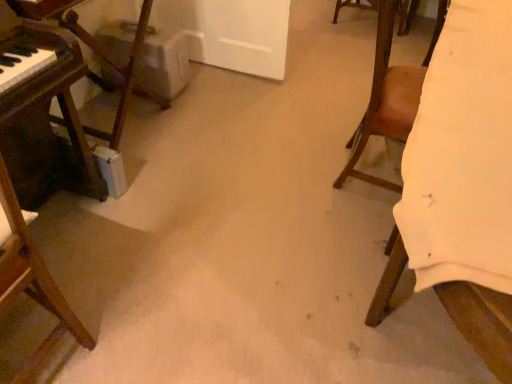
What are the coordinates of `brown wooden chair at left, which is the 1th chair in left-to-right order` in the screenshot? It's located at (31, 279).

What is the approximate width of brown leather chair at right, the 1th chair from the right?

brown leather chair at right, the 1th chair from the right, is 17.85 inches wide.

I want to click on wooden piano at left, marked as the 1th furniture in a left-to-right arrangement, so click(x=57, y=98).

Which of these two, brown wooden chair at left, which is the 1th chair in left-to-right order, or brown leather chair at right, which is the second chair in left-to-right order, is wider?

brown wooden chair at left, which is the 1th chair in left-to-right order, is wider.

Is brown wooden chair at left, the 2th chair from the right, looking in the opposite direction of brown leather chair at right, the 1th chair from the right?

No, brown wooden chair at left, the 2th chair from the right,'s orientation is not away from brown leather chair at right, the 1th chair from the right.

From the image's perspective, is brown wooden chair at left, the 2th chair from the right, beneath brown leather chair at right, which is the second chair in left-to-right order?

Yes.

Is brown wooden chair at left, the 2th chair from the right, in front of white fabric at right, the first furniture viewed from the right?

That is False.

From the image's perspective, between brown wooden chair at left, the 2th chair from the right, and white fabric at right, the first furniture viewed from the right, who is located below?

brown wooden chair at left, the 2th chair from the right, is shown below in the image.

Is point (33, 255) more distant than point (490, 325)?

Yes.

How far apart are brown wooden chair at left, the 2th chair from the right, and white fabric at right, the first furniture viewed from the right?

brown wooden chair at left, the 2th chair from the right, is 3.31 feet away from white fabric at right, the first furniture viewed from the right.

Between brown wooden chair at left, which is the 1th chair in left-to-right order, and wooden piano at left, acting as the 2th furniture starting from the right, which one has smaller size?

brown wooden chair at left, which is the 1th chair in left-to-right order.

Which of these two, brown wooden chair at left, which is the 1th chair in left-to-right order, or wooden piano at left, marked as the 1th furniture in a left-to-right arrangement, stands taller?

brown wooden chair at left, which is the 1th chair in left-to-right order.

From the image's perspective, between brown wooden chair at left, which is the 1th chair in left-to-right order, and wooden piano at left, acting as the 2th furniture starting from the right, who is located below?

From the image's view, brown wooden chair at left, which is the 1th chair in left-to-right order, is below.

Consider the image. Is brown leather chair at right, which is the second chair in left-to-right order, not inside brown wooden chair at left, which is the 1th chair in left-to-right order?

brown leather chair at right, which is the second chair in left-to-right order, is positioned outside brown wooden chair at left, which is the 1th chair in left-to-right order.

Measure the distance from brown leather chair at right, which is the second chair in left-to-right order, to brown wooden chair at left, the 2th chair from the right.

brown leather chair at right, which is the second chair in left-to-right order, and brown wooden chair at left, the 2th chair from the right, are 4.38 feet apart from each other.

Who is shorter, brown leather chair at right, which is the second chair in left-to-right order, or brown wooden chair at left, the 2th chair from the right?

Standing shorter between the two is brown leather chair at right, which is the second chair in left-to-right order.

Based on their sizes in the image, would you say brown leather chair at right, the 1th chair from the right, is bigger or smaller than brown wooden chair at left, the 2th chair from the right?

Clearly, brown leather chair at right, the 1th chair from the right, is larger in size than brown wooden chair at left, the 2th chair from the right.

Consider the image. Can brown wooden chair at left, which is the 1th chair in left-to-right order, be found inside white fabric at right, the 2th furniture from the left?

No, brown wooden chair at left, which is the 1th chair in left-to-right order, is not surrounded by white fabric at right, the 2th furniture from the left.

Between white fabric at right, the 2th furniture from the left, and brown wooden chair at left, the 2th chair from the right, which one has larger width?

With larger width is white fabric at right, the 2th furniture from the left.

Considering the relative sizes of white fabric at right, the first furniture viewed from the right, and brown wooden chair at left, the 2th chair from the right, in the image provided, is white fabric at right, the first furniture viewed from the right, smaller than brown wooden chair at left, the 2th chair from the right,?

No.

Which is more to the left, white fabric at right, the first furniture viewed from the right, or brown wooden chair at left, the 2th chair from the right?

Positioned to the left is brown wooden chair at left, the 2th chair from the right.

Would you say white fabric at right, the first furniture viewed from the right, is part of brown leather chair at right, the 1th chair from the right,'s contents?

Definitely not — white fabric at right, the first furniture viewed from the right, is not inside brown leather chair at right, the 1th chair from the right.

Is brown leather chair at right, which is the second chair in left-to-right order, oriented away from white fabric at right, the 2th furniture from the left?

Yes, brown leather chair at right, which is the second chair in left-to-right order, is positioned with its back facing white fabric at right, the 2th furniture from the left.

Where is `the 1st chair counting from the left side of the white fabric at right, the first furniture viewed from the right`? The height and width of the screenshot is (384, 512). the 1st chair counting from the left side of the white fabric at right, the first furniture viewed from the right is located at coordinates (389, 95).

Is brown leather chair at right, the 1th chair from the right, in front of or behind white fabric at right, the 2th furniture from the left, in the image?

brown leather chair at right, the 1th chair from the right, is behind white fabric at right, the 2th furniture from the left.

Is wooden piano at left, marked as the 1th furniture in a left-to-right arrangement, beside white fabric at right, the first furniture viewed from the right?

They are not placed beside each other.

Is wooden piano at left, marked as the 1th furniture in a left-to-right arrangement, bigger than white fabric at right, the 2th furniture from the left?

No, wooden piano at left, marked as the 1th furniture in a left-to-right arrangement, is not bigger than white fabric at right, the 2th furniture from the left.

Image resolution: width=512 pixels, height=384 pixels. What are the coordinates of `furniture on the right of wooden piano at left, marked as the 1th furniture in a left-to-right arrangement` in the screenshot? It's located at (481, 320).

You are a GUI agent. You are given a task and a screenshot of the screen. Output one action in this format:
    pyautogui.click(x=<x>, y=<y>)
    Task: Click on the chair that is on the left side of brown leather chair at right, the 1th chair from the right
    
    Given the screenshot: What is the action you would take?
    pyautogui.click(x=31, y=279)

Find the location of a particular element. the 1st chair behind the white fabric at right, the first furniture viewed from the right, counting from the anchor's position is located at coordinates (31, 279).

Which object lies further to the anchor point wooden piano at left, acting as the 2th furniture starting from the right, brown wooden chair at left, which is the 1th chair in left-to-right order, or white fabric at right, the first furniture viewed from the right?

white fabric at right, the first furniture viewed from the right, is further to wooden piano at left, acting as the 2th furniture starting from the right.

From the image, which object appears to be nearer to brown wooden chair at left, the 2th chair from the right, brown leather chair at right, the 1th chair from the right, or white fabric at right, the first furniture viewed from the right?

Based on the image, white fabric at right, the first furniture viewed from the right, appears to be nearer to brown wooden chair at left, the 2th chair from the right.

In the scene shown: Which object lies nearer to the anchor point wooden piano at left, acting as the 2th furniture starting from the right, white fabric at right, the first furniture viewed from the right, or brown leather chair at right, the 1th chair from the right?

Based on the image, brown leather chair at right, the 1th chair from the right, appears to be nearer to wooden piano at left, acting as the 2th furniture starting from the right.

Estimate the real-world distances between objects in this image. Which object is closer to wooden piano at left, marked as the 1th furniture in a left-to-right arrangement, white fabric at right, the 2th furniture from the left, or brown wooden chair at left, which is the 1th chair in left-to-right order?

brown wooden chair at left, which is the 1th chair in left-to-right order, is positioned closer to the anchor wooden piano at left, marked as the 1th furniture in a left-to-right arrangement.

Based on their spatial positions, is brown wooden chair at left, the 2th chair from the right, or wooden piano at left, marked as the 1th furniture in a left-to-right arrangement, closer to brown leather chair at right, the 1th chair from the right?

The object closer to brown leather chair at right, the 1th chair from the right, is wooden piano at left, marked as the 1th furniture in a left-to-right arrangement.

Looking at the image, which one is located further to brown leather chair at right, the 1th chair from the right, white fabric at right, the 2th furniture from the left, or wooden piano at left, acting as the 2th furniture starting from the right?

wooden piano at left, acting as the 2th furniture starting from the right, is further to brown leather chair at right, the 1th chair from the right.

Considering their positions, is white fabric at right, the first furniture viewed from the right, positioned further to brown leather chair at right, the 1th chair from the right, than brown wooden chair at left, which is the 1th chair in left-to-right order?

The object further to brown leather chair at right, the 1th chair from the right, is brown wooden chair at left, which is the 1th chair in left-to-right order.

Based on their spatial positions, is wooden piano at left, marked as the 1th furniture in a left-to-right arrangement, or brown leather chair at right, the 1th chair from the right, further from brown wooden chair at left, the 2th chair from the right?

brown leather chair at right, the 1th chair from the right, is further to brown wooden chair at left, the 2th chair from the right.

Identify the location of chair located between brown wooden chair at left, the 2th chair from the right, and white fabric at right, the first furniture viewed from the right, in the left-right direction. (389, 95).

Where is `chair situated between wooden piano at left, acting as the 2th furniture starting from the right, and brown leather chair at right, the 1th chair from the right, from left to right`? The width and height of the screenshot is (512, 384). chair situated between wooden piano at left, acting as the 2th furniture starting from the right, and brown leather chair at right, the 1th chair from the right, from left to right is located at coordinates (31, 279).